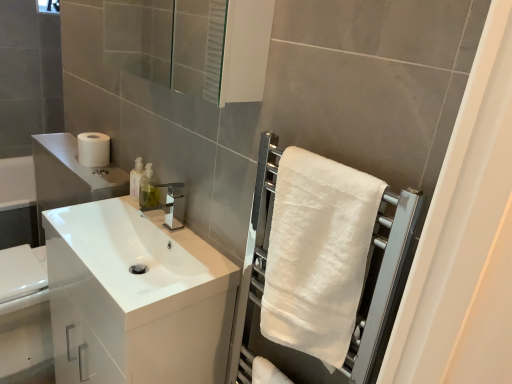
You are a GUI agent. You are given a task and a screenshot of the screen. Output one action in this format:
    pyautogui.click(x=<x>, y=<y>)
    Task: Click on the vacant space to the left of white matte toilet paper at left
    Image resolution: width=512 pixels, height=384 pixels.
    Given the screenshot: What is the action you would take?
    pyautogui.click(x=62, y=153)